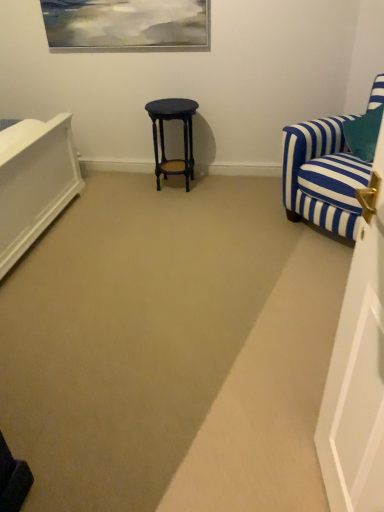
This screenshot has width=384, height=512. I want to click on matte black stool at center, so click(x=163, y=136).

Measure the distance between matte black stool at center and camera.

matte black stool at center is 3.16 meters away from camera.

The image size is (384, 512). Describe the element at coordinates (163, 136) in the screenshot. I see `matte black stool at center` at that location.

The width and height of the screenshot is (384, 512). Find the location of `blue striped fabric chair at right`. blue striped fabric chair at right is located at coordinates (322, 176).

Consider the image. Measure the distance between point (301, 162) and camera.

The distance of point (301, 162) from camera is 8.67 feet.

What do you see at coordinates (322, 176) in the screenshot? The image size is (384, 512). I see `blue striped fabric chair at right` at bounding box center [322, 176].

You are a GUI agent. You are given a task and a screenshot of the screen. Output one action in this format:
    pyautogui.click(x=<x>, y=<y>)
    Task: Click on the matte black stool at center
    The width and height of the screenshot is (384, 512).
    Given the screenshot: What is the action you would take?
    pyautogui.click(x=163, y=136)

Does matte black stool at center appear on the right side of blue striped fabric chair at right?

Incorrect, matte black stool at center is not on the right side of blue striped fabric chair at right.

Who is more distant, matte black stool at center or blue striped fabric chair at right?

matte black stool at center.

Considering the positions of points (188, 106) and (342, 160), is point (188, 106) closer to camera compared to point (342, 160)?

No, (188, 106) is behind (342, 160).

From the image's perspective, would you say matte black stool at center is shown under blue striped fabric chair at right?

No.

From a real-world perspective, is matte black stool at center under blue striped fabric chair at right?

Yes, from a real-world perspective, matte black stool at center is below blue striped fabric chair at right.

Considering the sizes of objects matte black stool at center and blue striped fabric chair at right in the image provided, who is wider, matte black stool at center or blue striped fabric chair at right?

blue striped fabric chair at right.

From the picture: Does matte black stool at center have a greater height compared to blue striped fabric chair at right?

In fact, matte black stool at center may be shorter than blue striped fabric chair at right.

Between matte black stool at center and blue striped fabric chair at right, which one has smaller size?

matte black stool at center is smaller.

From the picture: Would you say matte black stool at center contains blue striped fabric chair at right?

No, matte black stool at center does not contain blue striped fabric chair at right.

Is matte black stool at center directly adjacent to blue striped fabric chair at right?

No, matte black stool at center is not making contact with blue striped fabric chair at right.

Is matte black stool at center turned away from blue striped fabric chair at right?

That's not correct — matte black stool at center is not looking away from blue striped fabric chair at right.

How many degrees apart are the facing directions of matte black stool at center and blue striped fabric chair at right?

47.5 degrees separate the facing orientations of matte black stool at center and blue striped fabric chair at right.

How far apart are matte black stool at center and blue striped fabric chair at right?

3.53 feet.

Find the location of a particular element. stool that appears below the blue striped fabric chair at right (from a real-world perspective) is located at coordinates (163, 136).

Can you confirm if blue striped fabric chair at right is positioned to the right of matte black stool at center?

Yes.

Considering their positions, is blue striped fabric chair at right located in front of or behind matte black stool at center?

In the image, blue striped fabric chair at right appears in front of matte black stool at center.

Does point (368, 175) come behind point (167, 117)?

No, (368, 175) is closer to viewer.

Based on the photo, from the image's perspective, is blue striped fabric chair at right over matte black stool at center?

Incorrect, from the image's perspective, blue striped fabric chair at right is lower than matte black stool at center.

From a real-world perspective, is blue striped fabric chair at right below matte black stool at center?

Incorrect, from a real-world perspective, blue striped fabric chair at right is higher than matte black stool at center.

Considering the relative sizes of blue striped fabric chair at right and matte black stool at center in the image provided, is blue striped fabric chair at right thinner than matte black stool at center?

No.

In terms of height, does blue striped fabric chair at right look taller or shorter compared to matte black stool at center?

Considering their sizes, blue striped fabric chair at right has more height than matte black stool at center.

Which of these two, blue striped fabric chair at right or matte black stool at center, is smaller?

matte black stool at center.

Choose the correct answer: Is blue striped fabric chair at right inside matte black stool at center or outside it?

blue striped fabric chair at right is not enclosed by matte black stool at center.

Is blue striped fabric chair at right beside matte black stool at center?

They are not placed beside each other.

In the scene shown: Could you tell me if blue striped fabric chair at right is turned towards matte black stool at center?

No, blue striped fabric chair at right is not turned towards matte black stool at center.

At what (x,y) coordinates should I click in order to perform the action: click on chair on the right of matte black stool at center. Please return your answer as a coordinate pair (x, y). The image size is (384, 512). Looking at the image, I should click on (322, 176).

Where is `stool behind the blue striped fabric chair at right`? This screenshot has height=512, width=384. stool behind the blue striped fabric chair at right is located at coordinates (163, 136).

In the image, there is a blue striped fabric chair at right. Identify the location of stool above it (from the image's perspective). The height and width of the screenshot is (512, 384). (163, 136).